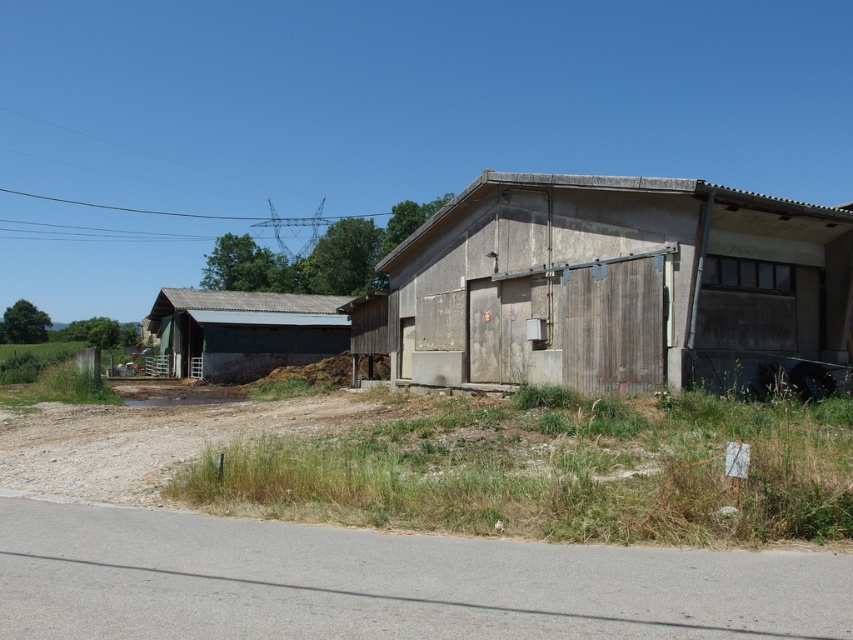
Question: Which point is closer to the camera?

Choices:
 (A) (712, 211)
 (B) (285, 362)

Answer: (A)

Question: Which of the following is the closest to the observer?

Choices:
 (A) rusty metal hut at left
 (B) rustic wood barn at center

Answer: (B)

Question: Does rustic wood barn at center appear on the right side of rusty metal hut at left?

Choices:
 (A) yes
 (B) no

Answer: (A)

Question: Is rustic wood barn at center to the right of rusty metal hut at left from the viewer's perspective?

Choices:
 (A) yes
 (B) no

Answer: (A)

Question: Which point is closer to the camera?

Choices:
 (A) rustic wood barn at center
 (B) rusty metal hut at left

Answer: (A)

Question: Does rustic wood barn at center come in front of rusty metal hut at left?

Choices:
 (A) no
 (B) yes

Answer: (B)